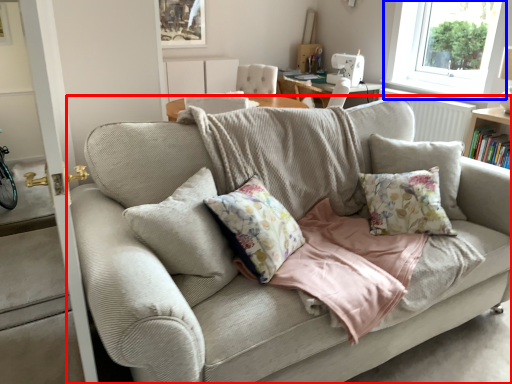
Question: Among these objects, which one is farthest to the camera, studio couch (highlighted by a red box) or window (highlighted by a blue box)?

Choices:
 (A) studio couch
 (B) window

Answer: (B)